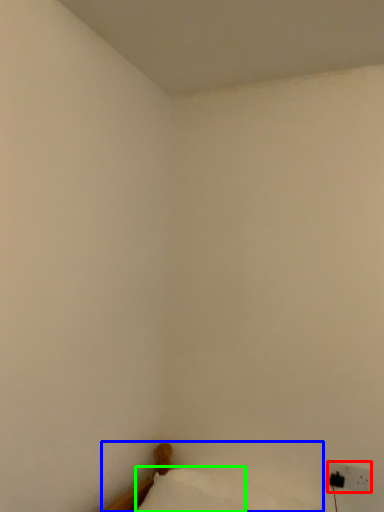
Question: Considering the real-world distances, which object is closest to electric outlet (highlighted by a red box)? furniture (highlighted by a blue box) or pillow (highlighted by a green box).

Choices:
 (A) furniture
 (B) pillow

Answer: (A)